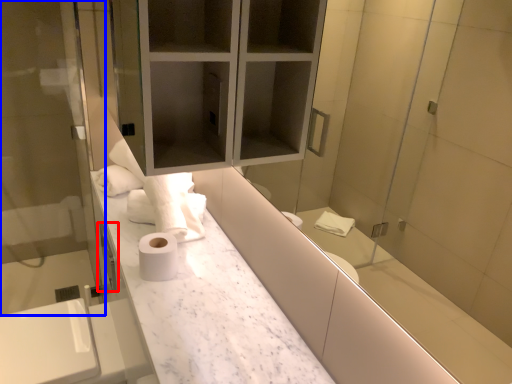
Question: Among these objects, which one is nearest to the camera, faucet (highlighted by a red box) or screen door (highlighted by a blue box)?

Choices:
 (A) faucet
 (B) screen door

Answer: (B)